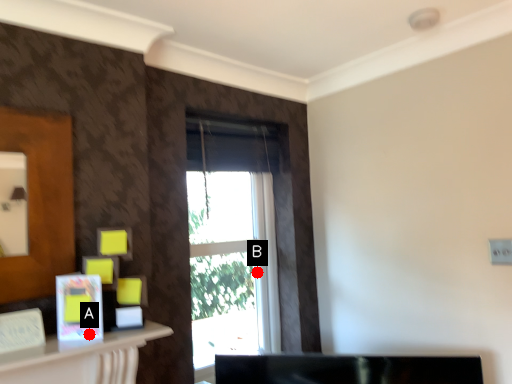
Question: Two points are circled on the image, labeled by A and B beside each circle. Which point is further to the camera?

Choices:
 (A) A is further
 (B) B is further

Answer: (B)